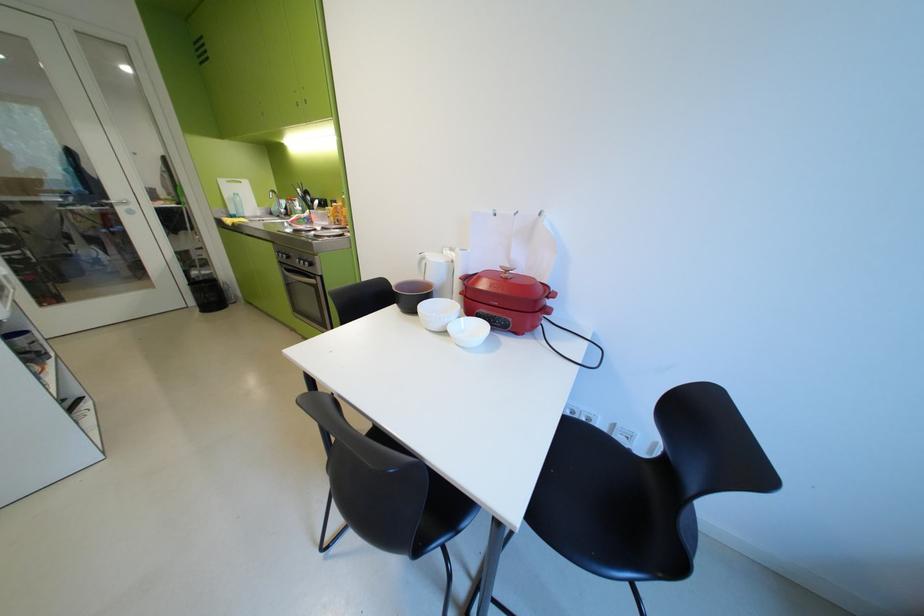
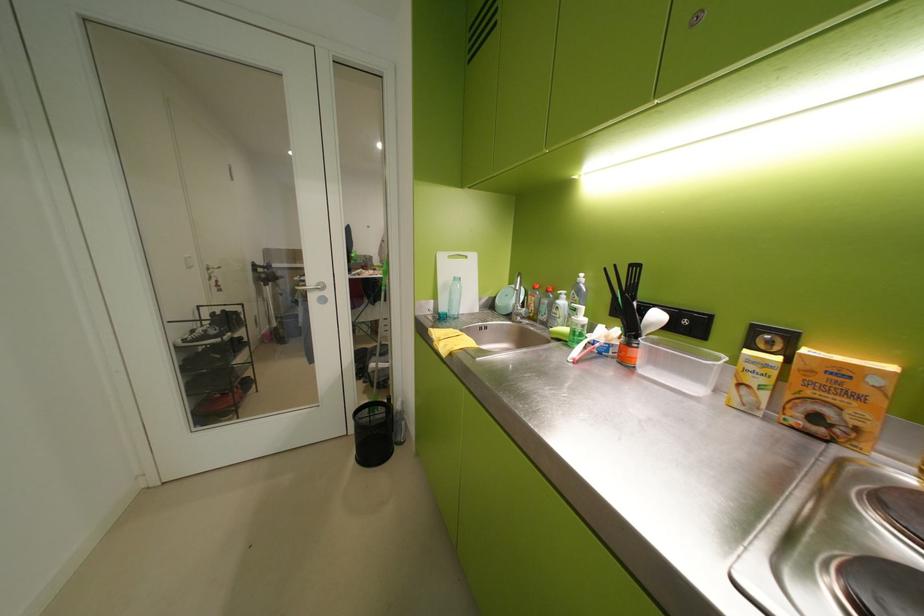
Where in the second image is the point corresponding to point 292,214 from the first image?

(529, 315)